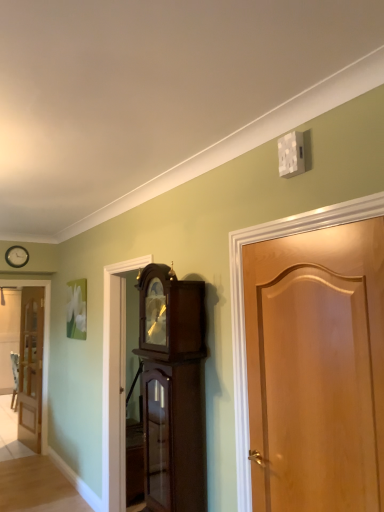
Identify the location of light brown wood door at right, arranged as the second door when viewed from the back. The image size is (384, 512). (317, 368).

Considering the relative positions of dark wood grandfather clock at center and light brown wooden door at left, the 2th door positioned from the right, in the image provided, is dark wood grandfather clock at center to the right of light brown wooden door at left, the 2th door positioned from the right, from the viewer's perspective?

Yes, dark wood grandfather clock at center is to the right of light brown wooden door at left, the 2th door positioned from the right.

Which of these two, dark wood grandfather clock at center or light brown wooden door at left, placed as the 1th door when sorted from back to front, stands taller?

light brown wooden door at left, placed as the 1th door when sorted from back to front, is taller.

Considering the sizes of objects dark wood grandfather clock at center and light brown wooden door at left, the first door positioned from the left, in the image provided, who is thinner, dark wood grandfather clock at center or light brown wooden door at left, the first door positioned from the left,?

light brown wooden door at left, the first door positioned from the left.

Between point (154, 465) and point (31, 353), which one is positioned in front?

Point (154, 465)

Is the surface of dark wood grandfather clock at center in direct contact with light brown wood door at right, the 1th door when ordered from front to back?

No, dark wood grandfather clock at center is not in contact with light brown wood door at right, the 1th door when ordered from front to back.

Which object is further away from the camera, dark wood grandfather clock at center or light brown wood door at right, which is the 1th door in right-to-left order?

Positioned behind is dark wood grandfather clock at center.

Does point (182, 464) appear closer or farther from the camera than point (342, 483)?

Point (182, 464).

Does dark wood grandfather clock at center appear on the left side of light brown wood door at right, the second door viewed from the left?

Yes.

Is matte black clock at upper left aimed at light brown wood door at right, the second door viewed from the left?

Yes, matte black clock at upper left is turned towards light brown wood door at right, the second door viewed from the left.

Considering the relative positions of matte black clock at upper left and light brown wood door at right, the 1th door when ordered from front to back, in the image provided, is matte black clock at upper left to the left or to the right of light brown wood door at right, the 1th door when ordered from front to back,?

Based on their positions, matte black clock at upper left is located to the left of light brown wood door at right, the 1th door when ordered from front to back.

Is point (8, 259) in front of point (346, 263)?

No, it is behind (346, 263).

From the image's perspective, is matte black clock at upper left positioned above or below light brown wood door at right, the second door viewed from the left?

Based on their image positions, matte black clock at upper left is located above light brown wood door at right, the second door viewed from the left.

Is light brown wood door at right, the second door viewed from the left, to the left of matte black clock at upper left from the viewer's perspective?

Incorrect, light brown wood door at right, the second door viewed from the left, is not on the left side of matte black clock at upper left.

From the image's perspective, does light brown wood door at right, which is the 1th door in right-to-left order, appear higher than matte black clock at upper left?

Incorrect, from the image's perspective, light brown wood door at right, which is the 1th door in right-to-left order, is lower than matte black clock at upper left.

Which is in front, point (300, 438) or point (5, 259)?

The point (300, 438) is more forward.

Can you see light brown wood door at right, arranged as the second door when viewed from the back, touching matte black clock at upper left?

No, light brown wood door at right, arranged as the second door when viewed from the back, is not in contact with matte black clock at upper left.

Would you say light brown wooden door at left, the 2th door positioned from the right, contains dark wood grandfather clock at center?

No, light brown wooden door at left, the 2th door positioned from the right, does not contain dark wood grandfather clock at center.

Is the surface of light brown wooden door at left, the second door in the front-to-back sequence, in direct contact with dark wood grandfather clock at center?

light brown wooden door at left, the second door in the front-to-back sequence, and dark wood grandfather clock at center are clearly separated.

Is light brown wooden door at left, the first door positioned from the left, far away from light brown wood door at right, arranged as the second door when viewed from the back?

Yes, light brown wooden door at left, the first door positioned from the left, is far from light brown wood door at right, arranged as the second door when viewed from the back.

I want to click on door in front of the light brown wooden door at left, the 2th door positioned from the right, so click(317, 368).

Which is in front, light brown wooden door at left, the 2th door positioned from the right, or light brown wood door at right, which is the 1th door in right-to-left order?

light brown wood door at right, which is the 1th door in right-to-left order, is in front.

Looking at this image, which is more distant, (38,413) or (344,434)?

The point (38,413) is more distant.

From a real-world perspective, which is physically above, dark wood grandfather clock at center or matte black clock at upper left?

matte black clock at upper left, from a real-world perspective.

Does dark wood grandfather clock at center have a smaller size compared to matte black clock at upper left?

No, dark wood grandfather clock at center is not smaller than matte black clock at upper left.

Considering the sizes of dark wood grandfather clock at center and matte black clock at upper left in the image, is dark wood grandfather clock at center wider or thinner than matte black clock at upper left?

dark wood grandfather clock at center is wider than matte black clock at upper left.

Locate an element on the screen. Image resolution: width=384 pixels, height=512 pixels. door behind the dark wood grandfather clock at center is located at coordinates (31, 367).

The image size is (384, 512). Identify the location of door lying in front of the dark wood grandfather clock at center. (317, 368).

Based on the photo, considering their positions, is light brown wooden door at left, the first door positioned from the left, positioned further to light brown wood door at right, arranged as the second door when viewed from the back, than matte black clock at upper left?

Among the two, light brown wooden door at left, the first door positioned from the left, is located further to light brown wood door at right, arranged as the second door when viewed from the back.

Estimate the real-world distances between objects in this image. Which object is further from matte black clock at upper left, light brown wooden door at left, placed as the 1th door when sorted from back to front, or dark wood grandfather clock at center?

Among the two, dark wood grandfather clock at center is located further to matte black clock at upper left.

In the scene shown: Estimate the real-world distances between objects in this image. Which object is closer to light brown wood door at right, which is the 1th door in right-to-left order, matte black clock at upper left or light brown wooden door at left, the first door positioned from the left?

The object closer to light brown wood door at right, which is the 1th door in right-to-left order, is matte black clock at upper left.

Based on their spatial positions, is matte black clock at upper left or light brown wood door at right, arranged as the second door when viewed from the back, closer to light brown wooden door at left, the 2th door positioned from the right?

Among the two, matte black clock at upper left is located nearer to light brown wooden door at left, the 2th door positioned from the right.

Estimate the real-world distances between objects in this image. Which object is closer to dark wood grandfather clock at center, matte black clock at upper left or light brown wood door at right, the second door viewed from the left?

light brown wood door at right, the second door viewed from the left, lies closer to dark wood grandfather clock at center than the other object.

Looking at the image, which one is located further to matte black clock at upper left, dark wood grandfather clock at center or light brown wood door at right, arranged as the second door when viewed from the back?

Among the two, light brown wood door at right, arranged as the second door when viewed from the back, is located further to matte black clock at upper left.

When comparing their distances from dark wood grandfather clock at center, does light brown wood door at right, arranged as the second door when viewed from the back, or light brown wooden door at left, placed as the 1th door when sorted from back to front, seem further?

Among the two, light brown wooden door at left, placed as the 1th door when sorted from back to front, is located further to dark wood grandfather clock at center.

Based on the photo, when comparing their distances from matte black clock at upper left, does light brown wood door at right, the second door viewed from the left, or dark wood grandfather clock at center seem further?

light brown wood door at right, the second door viewed from the left, is positioned further to the anchor matte black clock at upper left.

Where is `cabinetry positioned between light brown wood door at right, the 1th door when ordered from front to back, and matte black clock at upper left from near to far`? The height and width of the screenshot is (512, 384). cabinetry positioned between light brown wood door at right, the 1th door when ordered from front to back, and matte black clock at upper left from near to far is located at coordinates 173,390.

This screenshot has width=384, height=512. In order to click on clock located between light brown wood door at right, arranged as the second door when viewed from the back, and light brown wooden door at left, the first door positioned from the left, in the depth direction in this screenshot , I will do `click(17, 256)`.

At what (x,y) coordinates should I click in order to perform the action: click on clock between dark wood grandfather clock at center and light brown wooden door at left, the 2th door positioned from the right, in the front-back direction. Please return your answer as a coordinate pair (x, y). The width and height of the screenshot is (384, 512). Looking at the image, I should click on (17, 256).

The image size is (384, 512). In order to click on cabinetry located between light brown wood door at right, which is the 1th door in right-to-left order, and light brown wooden door at left, the 2th door positioned from the right, in the depth direction in this screenshot , I will do `click(173, 390)`.